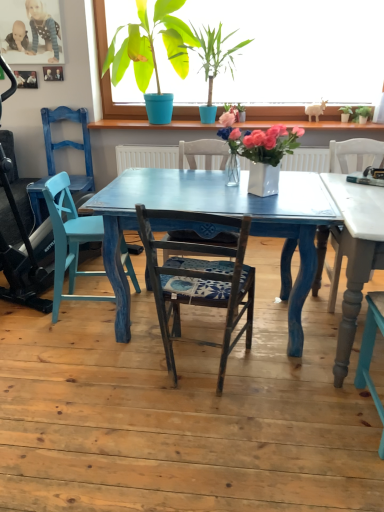
Question: Is wooden chair with cushion at center completely or partially outside of green leafy plant at upper center, which is counted as the fifth houseplant, starting from the left?

Choices:
 (A) no
 (B) yes

Answer: (B)

Question: Does wooden chair with cushion at center turn towards green leafy plant at upper center, which is counted as the first houseplant, starting from the right?

Choices:
 (A) no
 (B) yes

Answer: (B)

Question: Is wooden chair with cushion at center at the right side of green leafy plant at upper center, which is counted as the first houseplant, starting from the right?

Choices:
 (A) yes
 (B) no

Answer: (B)

Question: Is wooden chair with cushion at center taller than green leafy plant at upper center, which is counted as the fifth houseplant, starting from the left?

Choices:
 (A) no
 (B) yes

Answer: (B)

Question: Does wooden chair with cushion at center have a lesser width compared to green leafy plant at upper center, which is counted as the fifth houseplant, starting from the left?

Choices:
 (A) no
 (B) yes

Answer: (A)

Question: Is blue dotted dress at upper left inside the boundaries of white ceramic vase at center, the third houseplant in the left-to-right sequence, or outside?

Choices:
 (A) inside
 (B) outside

Answer: (B)

Question: In terms of height, does blue dotted dress at upper left look taller or shorter compared to white ceramic vase at center, the third houseplant in the left-to-right sequence?

Choices:
 (A) tall
 (B) short

Answer: (A)

Question: From the image's perspective, is blue dotted dress at upper left positioned above or below white ceramic vase at center, the third houseplant positioned from the right?

Choices:
 (A) above
 (B) below

Answer: (A)

Question: Considering the positions of point (54, 57) and point (261, 134), is point (54, 57) closer or farther from the camera than point (261, 134)?

Choices:
 (A) closer
 (B) farther

Answer: (B)

Question: Based on their sizes in the image, would you say green leafy plant at upper center, which is counted as the fifth houseplant, starting from the left, is bigger or smaller than wooden chair with cushion at center?

Choices:
 (A) big
 (B) small

Answer: (B)

Question: Considering the positions of green leafy plant at upper center, which is counted as the fifth houseplant, starting from the left, and wooden chair with cushion at center in the image, is green leafy plant at upper center, which is counted as the fifth houseplant, starting from the left, taller or shorter than wooden chair with cushion at center?

Choices:
 (A) tall
 (B) short

Answer: (B)

Question: Relative to wooden chair with cushion at center, is green leafy plant at upper center, which is counted as the fifth houseplant, starting from the left, in front or behind?

Choices:
 (A) front
 (B) behind

Answer: (B)

Question: In the image, is green leafy plant at upper center, which is counted as the fifth houseplant, starting from the left, on the left side or the right side of wooden chair with cushion at center?

Choices:
 (A) right
 (B) left

Answer: (A)

Question: In the image, is matte blue chair at left on the left side or the right side of white ceramic vase at center, the third houseplant positioned from the right?

Choices:
 (A) right
 (B) left

Answer: (B)

Question: In terms of width, does matte blue chair at left look wider or thinner when compared to white ceramic vase at center, the third houseplant positioned from the right?

Choices:
 (A) wide
 (B) thin

Answer: (A)